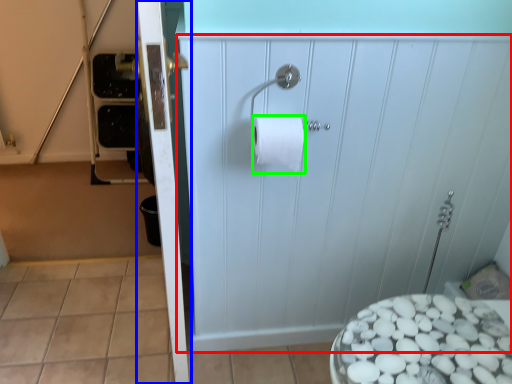
Question: Based on their relative distances, which object is farther from screen door (highlighted by a red box)? Choose from screen door (highlighted by a blue box) and toilet paper (highlighted by a green box).

Choices:
 (A) screen door
 (B) toilet paper

Answer: (A)